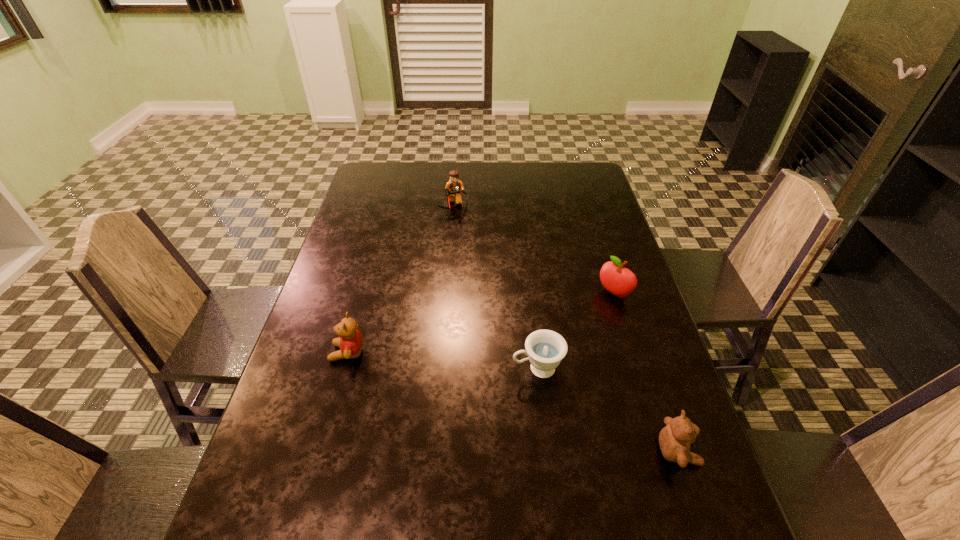
This screenshot has height=540, width=960. I want to click on the left teddy bear, so (351, 342).

Where is `the leftmost object`? the leftmost object is located at coordinates (351, 342).

What are the coordinates of `the nearer teddy bear` in the screenshot? It's located at (674, 439).

Locate an element on the screen. The width and height of the screenshot is (960, 540). the nearest object is located at coordinates (674, 439).

At what (x,y) coordinates should I click in order to perform the action: click on apple. Please return your answer as a coordinate pair (x, y). This screenshot has height=540, width=960. Looking at the image, I should click on (615, 278).

The image size is (960, 540). I want to click on the shortest object, so click(545, 349).

At what (x,y) coordinates should I click in order to perform the action: click on the third object from left to right. Please return your answer as a coordinate pair (x, y). The width and height of the screenshot is (960, 540). Looking at the image, I should click on (545, 349).

Locate an element on the screen. Image resolution: width=960 pixels, height=540 pixels. Lego is located at coordinates pos(454,188).

This screenshot has height=540, width=960. In order to click on the fourth object from right to left in this screenshot , I will do `click(454, 188)`.

Find the location of `free space located 0.330m on the front-facing side of the second farthest object`. free space located 0.330m on the front-facing side of the second farthest object is located at coordinates (524, 369).